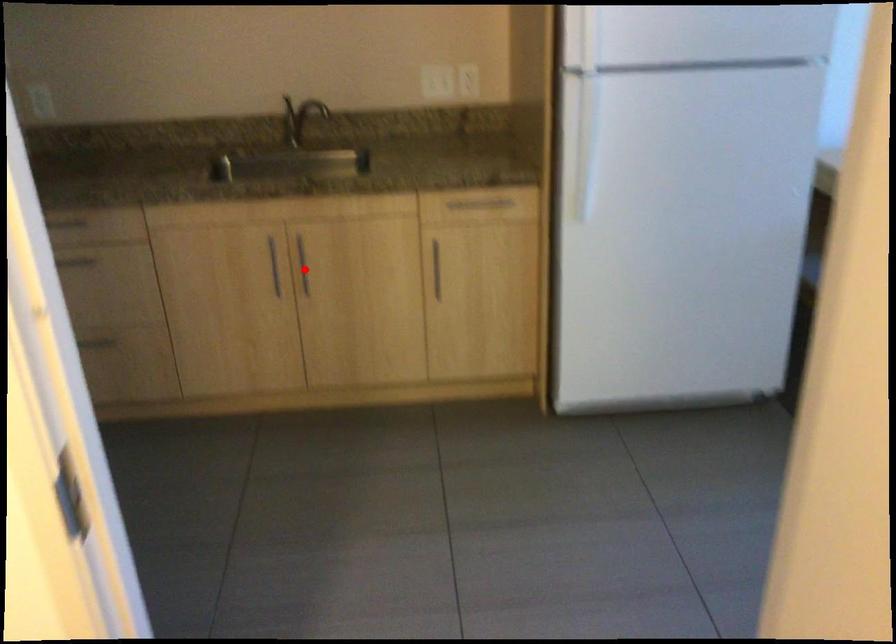
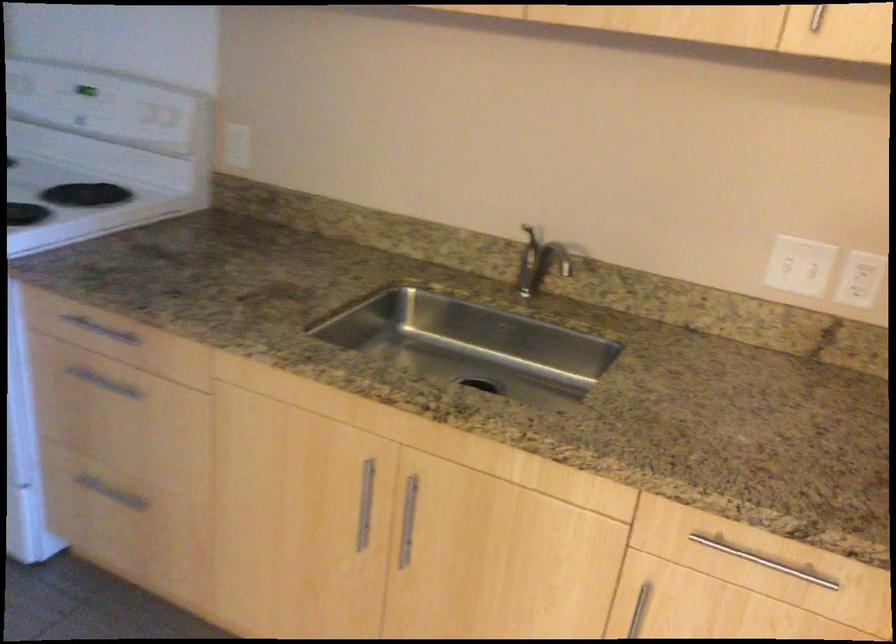
Question: A red point is marked in image1. In image2, is the corresponding 3D point closer to the camera or farther? Reply with the corresponding letter.

Choices:
 (A) The corresponding 3D point is closer.
 (B) The corresponding 3D point is farther.

Answer: (A)